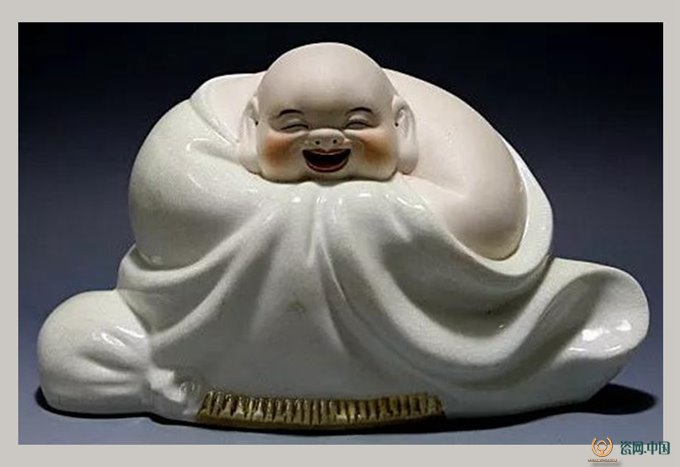
The image size is (680, 467). I want to click on figurine, so click(326, 313).